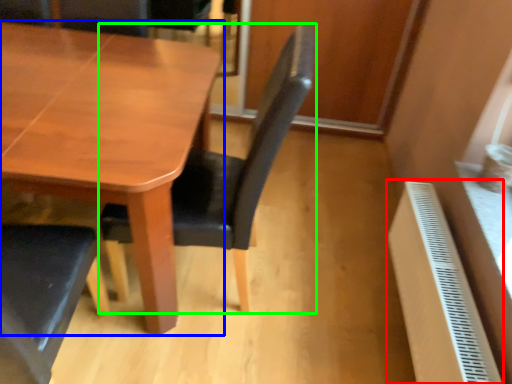
Question: Which object is positioned farthest from radiator (highlighted by a red box)? Select from table (highlighted by a blue box) and chair (highlighted by a green box).

Choices:
 (A) table
 (B) chair

Answer: (A)